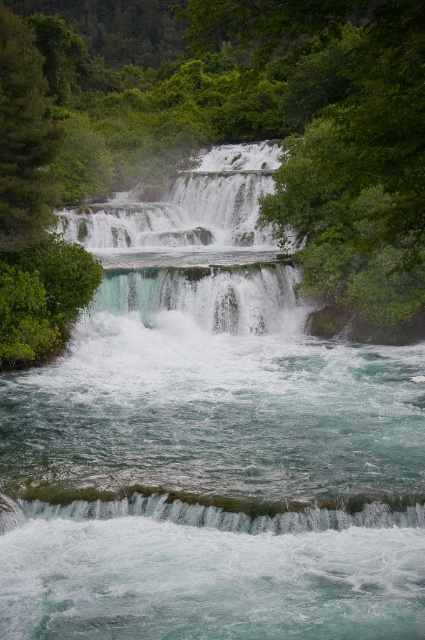
Question: Is the position of green leafy tree at center more distant than that of white frothy water at center?

Choices:
 (A) yes
 (B) no

Answer: (B)

Question: Among these objects, which one is nearest to the camera?

Choices:
 (A) white frothy water at center
 (B) green leafy tree at center
 (C) translucent glass waterfall at lower center

Answer: (B)

Question: Is green leafy tree at center to the right of translucent glass waterfall at lower center from the viewer's perspective?

Choices:
 (A) yes
 (B) no

Answer: (B)

Question: Can you confirm if white frothy water at center is wider than translucent glass waterfall at lower center?

Choices:
 (A) yes
 (B) no

Answer: (A)

Question: Among these objects, which one is farthest from the camera?

Choices:
 (A) translucent glass waterfall at lower center
 (B) white frothy water at center
 (C) green leafy tree at center

Answer: (B)

Question: Among these points, which one is nearest to the camera?

Choices:
 (A) (402, 6)
 (B) (11, 506)
 (C) (232, 227)

Answer: (A)